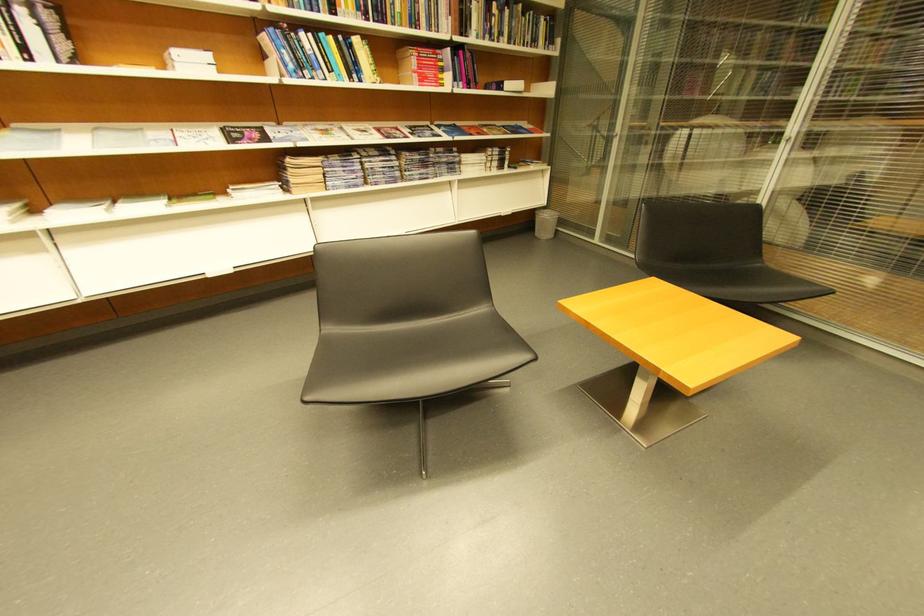
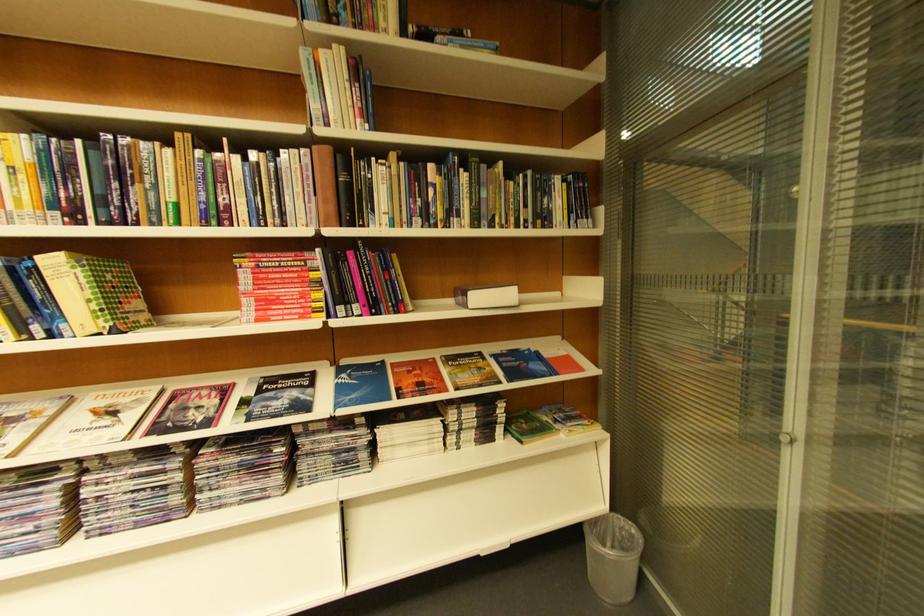
Locate, in the second image, the point that corresponds to [434,55] in the first image.

(281, 262)